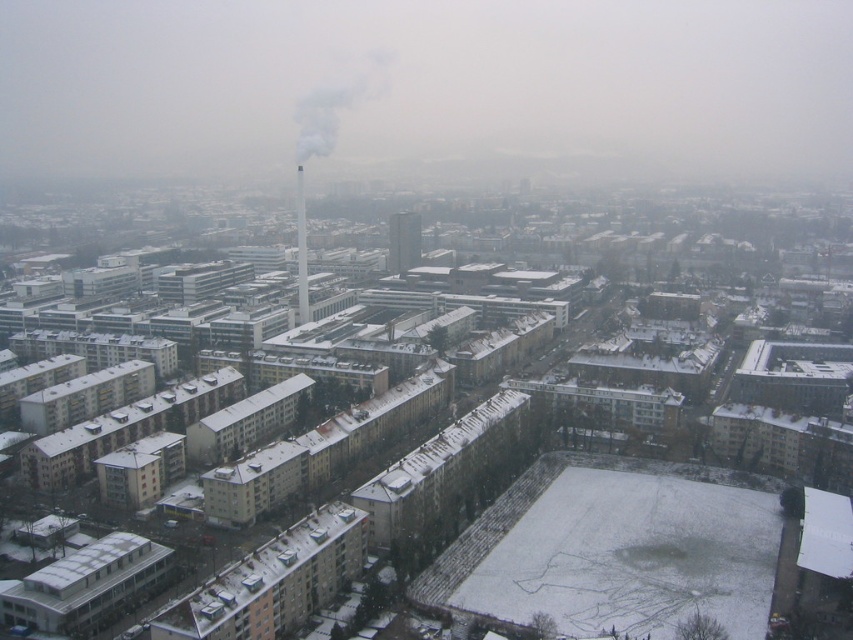
Does point (323, 136) come in front of point (395, 218)?

No, it is behind (395, 218).

Can you confirm if white smoke at center is taller than smooth concrete tower at center?

Indeed, white smoke at center has a greater height compared to smooth concrete tower at center.

Which is behind, point (331, 124) or point (399, 234)?

Positioned behind is point (331, 124).

You are a GUI agent. You are given a task and a screenshot of the screen. Output one action in this format:
    pyautogui.click(x=<x>, y=<y>)
    Task: Click on the white smoke at center
    This screenshot has height=640, width=853.
    Given the screenshot: What is the action you would take?
    pyautogui.click(x=335, y=106)

Find the location of a particular element. Image resolution: width=853 pixels, height=640 pixels. snow-covered building at center is located at coordinates (619, 259).

Can you confirm if snow-covered building at center is bigger than smooth glass tower at center?

Indeed, snow-covered building at center has a larger size compared to smooth glass tower at center.

Is point (320, 292) behind point (306, 300)?

Yes.

Where is `snow-covered building at center`? The width and height of the screenshot is (853, 640). snow-covered building at center is located at coordinates (619, 259).

Between snow-covered building at center and white smoke at center, which one has less height?

Standing shorter between the two is white smoke at center.

Between snow-covered building at center and white smoke at center, which one is positioned higher?

Positioned higher is white smoke at center.

Is point (463, 301) more distant than point (335, 140)?

No, (463, 301) is in front of (335, 140).

Find the location of a particular element. snow-covered building at center is located at coordinates (619, 259).